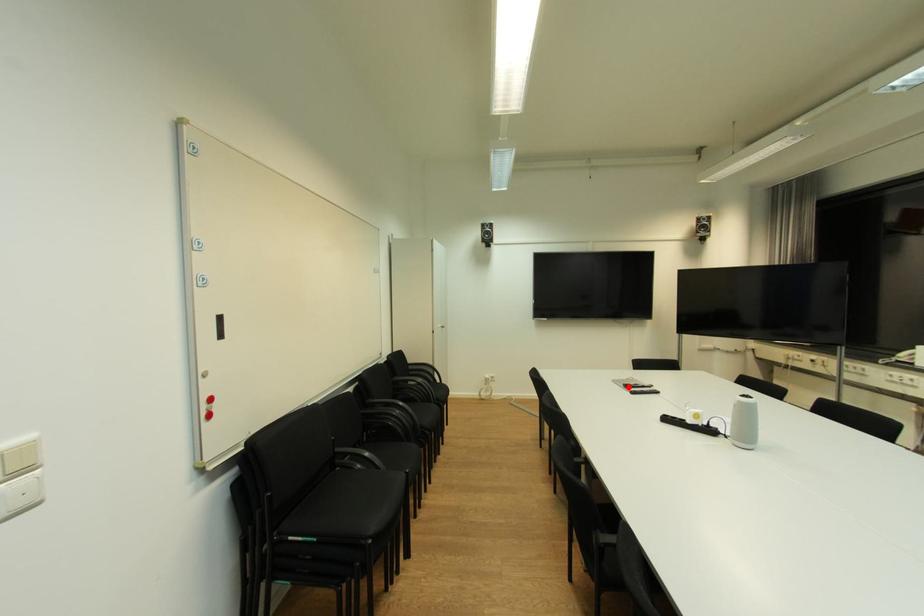
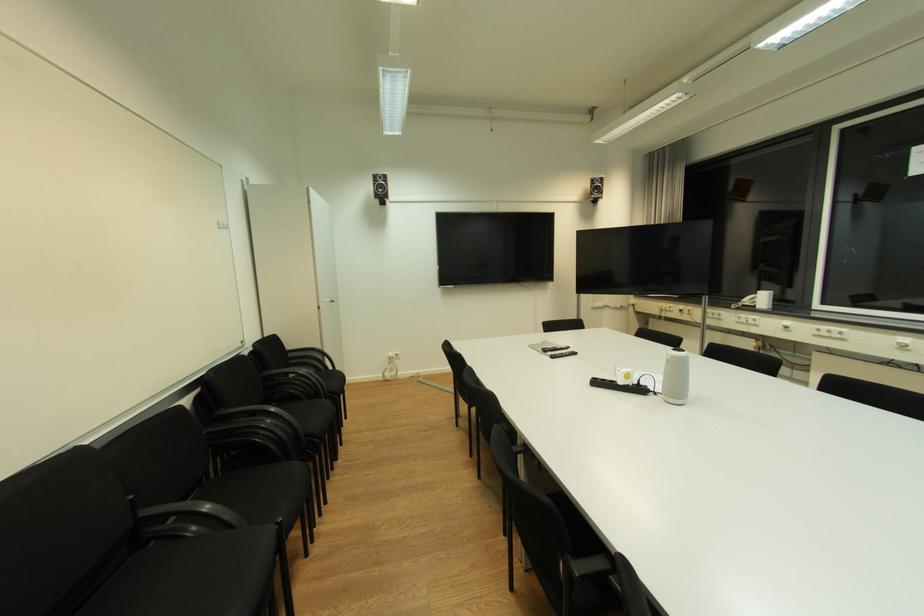
Question: I am providing you with two images of the same scene from different viewpoints. A red point is marked on the first image. Can you still see the location of the red point in image 2?

Choices:
 (A) Yes
 (B) No

Answer: (A)